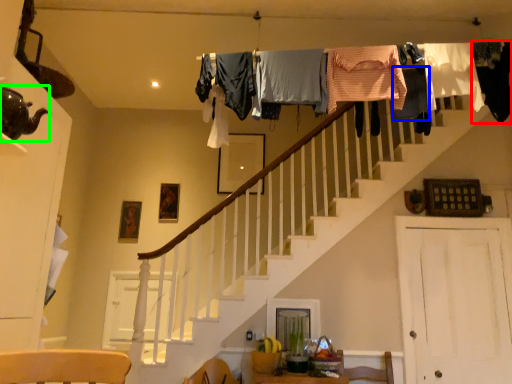
Question: Estimate the real-world distances between objects in this image. Which object is farther from clothing (highlighted by a red box), clothing (highlighted by a blue box) or tea pot (highlighted by a green box)?

Choices:
 (A) clothing
 (B) tea pot

Answer: (B)